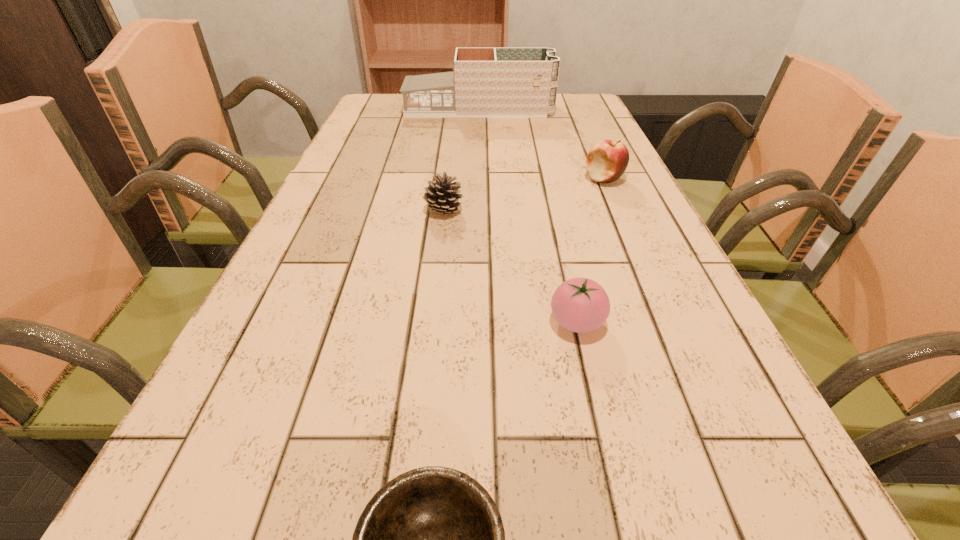
Identify the location of the farthest object. This screenshot has height=540, width=960. (485, 82).

You are a GUI agent. You are given a task and a screenshot of the screen. Output one action in this format:
    pyautogui.click(x=<x>, y=<y>)
    Task: Click on the dollhouse
    This screenshot has height=540, width=960.
    Given the screenshot: What is the action you would take?
    485,82

Identify the location of the rightmost object. (607, 160).

The width and height of the screenshot is (960, 540). I want to click on apple, so click(607, 160).

The height and width of the screenshot is (540, 960). I want to click on the third nearest object, so click(x=442, y=196).

At what (x,y) coordinates should I click in order to perform the action: click on tomato. Please return your answer as a coordinate pair (x, y). This screenshot has width=960, height=540. Looking at the image, I should click on (581, 305).

What are the coordinates of `free space located at the entrance of the farthest object` in the screenshot? It's located at (574, 110).

Find the location of `vacant space situated on the front of the rightmost object`. vacant space situated on the front of the rightmost object is located at coordinates (656, 300).

The image size is (960, 540). In order to click on free space located on the left of the pinecone in this screenshot , I will do `click(374, 211)`.

In order to click on free spot located on the left of the tomato in this screenshot , I will do `click(385, 322)`.